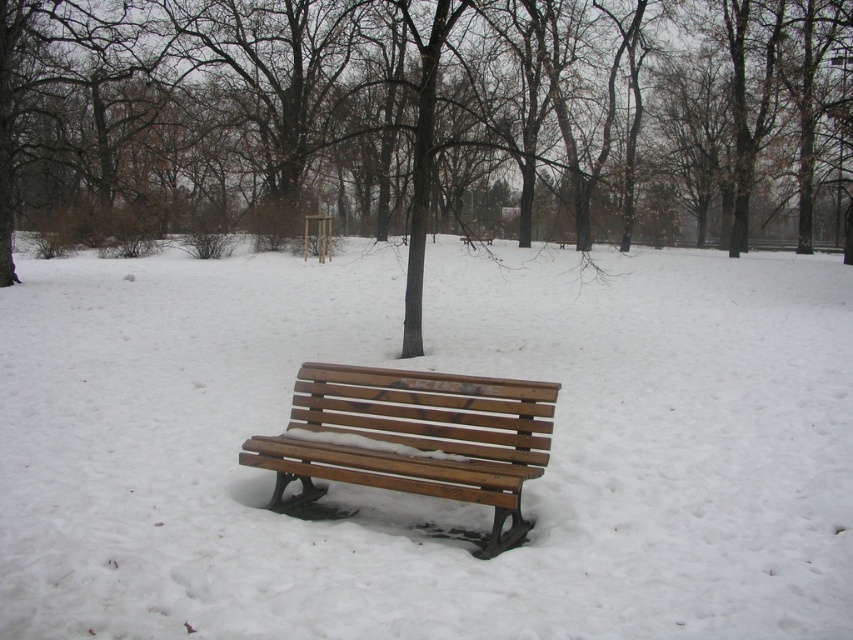
Question: Among these points, which one is farthest from the camera?

Choices:
 (A) (756, 70)
 (B) (486, 449)
 (C) (711, 269)

Answer: (A)

Question: Which object appears closest to the camera in this image?

Choices:
 (A) brown wood tree at center
 (B) wooden bench at center

Answer: (B)

Question: Where is brown wood tree at center located in relation to wooden bench at center in the image?

Choices:
 (A) below
 (B) above

Answer: (B)

Question: Is white matte snow at center below wooden bench at center?

Choices:
 (A) no
 (B) yes

Answer: (A)

Question: Which point is farther to the camera?

Choices:
 (A) brown wood tree at center
 (B) wooden bench at center
 (C) white matte snow at center

Answer: (A)

Question: Can you confirm if brown wood tree at center is positioned above wooden bench at center?

Choices:
 (A) no
 (B) yes

Answer: (B)